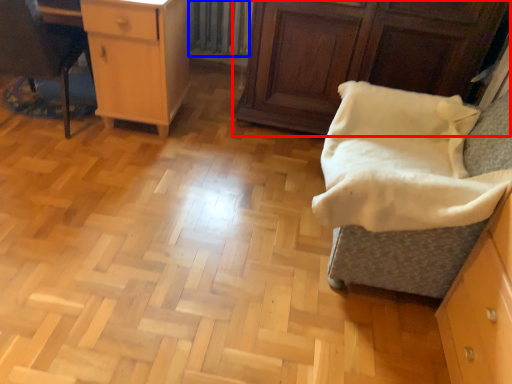
Question: Which point is closer to the camera, cabinetry (highlighted by a red box) or radiator (highlighted by a blue box)?

Choices:
 (A) cabinetry
 (B) radiator

Answer: (A)